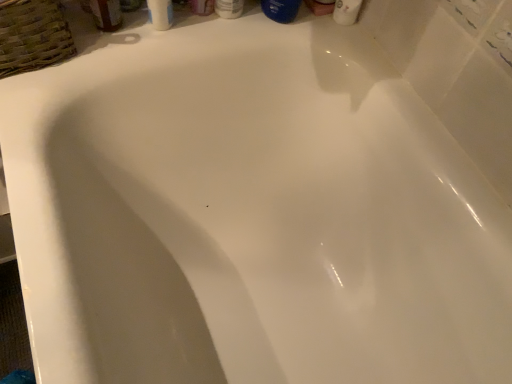
Locate an element on the screen. The width and height of the screenshot is (512, 384). white glossy bottle at upper center, the second toiletry from the left is located at coordinates (229, 8).

The image size is (512, 384). Identify the location of woven brown basket at upper left. (33, 36).

In order to face blue glossy bottle at upper center, placed as the first mouthwash when sorted from right to left, should I rotate leftwards or rightwards?

Rotate right and turn 3.417 degrees.

Find the location of `blue glossy bottle at upper center, the second mouthwash in the left-to-right sequence`. blue glossy bottle at upper center, the second mouthwash in the left-to-right sequence is located at coordinates (281, 10).

This screenshot has height=384, width=512. Identify the location of white glossy bottle at upper center, the second toiletry from the left. pyautogui.click(x=229, y=8).

Which is closer, (18,33) or (222,10)?

Point (18,33).

Considering the sizes of woven brown basket at upper left and white glossy bottle at upper center, the 1th toiletry in the right-to-left sequence, in the image, is woven brown basket at upper left taller or shorter than white glossy bottle at upper center, the 1th toiletry in the right-to-left sequence,?

woven brown basket at upper left is shorter than white glossy bottle at upper center, the 1th toiletry in the right-to-left sequence.

From the image's perspective, does woven brown basket at upper left appear higher than white glossy bottle at upper center, the 1th toiletry in the right-to-left sequence?

Incorrect, from the image's perspective, woven brown basket at upper left is lower than white glossy bottle at upper center, the 1th toiletry in the right-to-left sequence.

How distant is woven brown basket at upper left from white glossy bottle at upper center, the second toiletry from the left?

woven brown basket at upper left and white glossy bottle at upper center, the second toiletry from the left, are 33.63 centimeters apart.

Does translucent plastic mouthwash at upper left, the 1th mouthwash viewed from the left, have a larger size compared to matte plastic bottle at upper center, the second toiletry from the right?

No.

Which object is positioned more to the right, translucent plastic mouthwash at upper left, the 1th mouthwash viewed from the left, or matte plastic bottle at upper center, the first toiletry when ordered from left to right?

matte plastic bottle at upper center, the first toiletry when ordered from left to right, is more to the right.

Is translucent plastic mouthwash at upper left, the 2th mouthwash positioned from the right, shorter than matte plastic bottle at upper center, the first toiletry when ordered from left to right?

Yes, translucent plastic mouthwash at upper left, the 2th mouthwash positioned from the right, is shorter than matte plastic bottle at upper center, the first toiletry when ordered from left to right.

Between point (101, 25) and point (70, 38), which one is positioned in front?

The point (70, 38) is closer to the camera.

You are a GUI agent. You are given a task and a screenshot of the screen. Output one action in this format:
    pyautogui.click(x=<x>, y=<y>)
    Task: Click on the 1st mouthwash to the right of the woven brown basket at upper left, starting your count from the anchor
    The image size is (512, 384).
    Given the screenshot: What is the action you would take?
    pyautogui.click(x=106, y=14)

Is translucent plastic mouthwash at upper left, the 2th mouthwash positioned from the right, at the right side of woven brown basket at upper left?

Indeed, translucent plastic mouthwash at upper left, the 2th mouthwash positioned from the right, is positioned on the right side of woven brown basket at upper left.

Does translucent plastic mouthwash at upper left, the 2th mouthwash positioned from the right, have a smaller size compared to woven brown basket at upper left?

Correct, translucent plastic mouthwash at upper left, the 2th mouthwash positioned from the right, occupies less space than woven brown basket at upper left.

Which is in front, point (193, 0) or point (37, 32)?

The point (37, 32) is closer.

Is matte plastic bottle at upper center, the second toiletry from the right, inside or outside of woven brown basket at upper left?

matte plastic bottle at upper center, the second toiletry from the right, is not enclosed by woven brown basket at upper left.

Which object is more forward, matte plastic bottle at upper center, the second toiletry from the right, or woven brown basket at upper left?

woven brown basket at upper left is in front.

Measure the distance from matte plastic bottle at upper center, the first toiletry when ordered from left to right, to blue glossy bottle at upper center, the second mouthwash in the left-to-right sequence.

12.81 centimeters.

Between matte plastic bottle at upper center, the second toiletry from the right, and blue glossy bottle at upper center, the second mouthwash in the left-to-right sequence, which one has larger size?

Bigger between the two is blue glossy bottle at upper center, the second mouthwash in the left-to-right sequence.

Is matte plastic bottle at upper center, the first toiletry when ordered from left to right, facing towards blue glossy bottle at upper center, placed as the first mouthwash when sorted from right to left?

No, matte plastic bottle at upper center, the first toiletry when ordered from left to right, does not turn towards blue glossy bottle at upper center, placed as the first mouthwash when sorted from right to left.

The width and height of the screenshot is (512, 384). What are the coordinates of `the 2nd mouthwash in front of the matte plastic bottle at upper center, the second toiletry from the right, starting your count from the anchor` in the screenshot? It's located at (281, 10).

From a real-world perspective, starting from the blue glossy bottle at upper center, the second mouthwash in the left-to-right sequence, which toiletry is the 1st one below it? Please provide its 2D coordinates.

[(229, 8)]

What's the angular difference between white glossy bottle at upper center, the 1th toiletry in the right-to-left sequence, and blue glossy bottle at upper center, the second mouthwash in the left-to-right sequence,'s facing directions?

white glossy bottle at upper center, the 1th toiletry in the right-to-left sequence, and blue glossy bottle at upper center, the second mouthwash in the left-to-right sequence, are facing 60.2 degrees away from each other.

Considering their positions, is white glossy bottle at upper center, the 1th toiletry in the right-to-left sequence, located in front of or behind blue glossy bottle at upper center, placed as the first mouthwash when sorted from right to left?

Clearly, white glossy bottle at upper center, the 1th toiletry in the right-to-left sequence, is behind blue glossy bottle at upper center, placed as the first mouthwash when sorted from right to left.

Is white glossy bottle at upper center, the second toiletry from the left, surrounding blue glossy bottle at upper center, the second mouthwash in the left-to-right sequence?

No, blue glossy bottle at upper center, the second mouthwash in the left-to-right sequence, is located outside of white glossy bottle at upper center, the second toiletry from the left.

In terms of width, does woven brown basket at upper left look wider or thinner when compared to matte plastic bottle at upper center, the second toiletry from the right?

In the image, woven brown basket at upper left appears to be wider than matte plastic bottle at upper center, the second toiletry from the right.

Choose the correct answer: Is woven brown basket at upper left inside matte plastic bottle at upper center, the second toiletry from the right, or outside it?

woven brown basket at upper left exists outside the volume of matte plastic bottle at upper center, the second toiletry from the right.

Is woven brown basket at upper left positioned far away from matte plastic bottle at upper center, the first toiletry when ordered from left to right?

woven brown basket at upper left is near matte plastic bottle at upper center, the first toiletry when ordered from left to right, not far away.

Considering the positions of points (11, 32) and (209, 10), is point (11, 32) farther from camera compared to point (209, 10)?

That is False.

Which toiletry is the 2nd one when counting from the right side of the woven brown basket at upper left? Please provide its 2D coordinates.

[(229, 8)]

Find the location of `mouthwash below the matte plastic bottle at upper center, the second toiletry from the right (from the image's perspective)`. mouthwash below the matte plastic bottle at upper center, the second toiletry from the right (from the image's perspective) is located at coordinates point(106,14).

Based on their spatial positions, is blue glossy bottle at upper center, the second mouthwash in the left-to-right sequence, or woven brown basket at upper left further from translucent plastic mouthwash at upper left, the 2th mouthwash positioned from the right?

Among the two, blue glossy bottle at upper center, the second mouthwash in the left-to-right sequence, is located further to translucent plastic mouthwash at upper left, the 2th mouthwash positioned from the right.

When comparing their distances from blue glossy bottle at upper center, the second mouthwash in the left-to-right sequence, does translucent plastic mouthwash at upper left, the 1th mouthwash viewed from the left, or matte plastic bottle at upper center, the second toiletry from the right, seem further?

translucent plastic mouthwash at upper left, the 1th mouthwash viewed from the left, is positioned further to the anchor blue glossy bottle at upper center, the second mouthwash in the left-to-right sequence.

Estimate the real-world distances between objects in this image. Which object is closer to white glossy bottle at upper center, the 1th toiletry in the right-to-left sequence, translucent plastic mouthwash at upper left, the 1th mouthwash viewed from the left, or woven brown basket at upper left?

The object closer to white glossy bottle at upper center, the 1th toiletry in the right-to-left sequence, is translucent plastic mouthwash at upper left, the 1th mouthwash viewed from the left.

Which object lies nearer to the anchor point white glossy bottle at upper center, the 1th toiletry in the right-to-left sequence, blue glossy bottle at upper center, placed as the first mouthwash when sorted from right to left, or matte plastic bottle at upper center, the second toiletry from the right?

matte plastic bottle at upper center, the second toiletry from the right, lies closer to white glossy bottle at upper center, the 1th toiletry in the right-to-left sequence, than the other object.

Which object lies further to the anchor point matte plastic bottle at upper center, the second toiletry from the right, woven brown basket at upper left or blue glossy bottle at upper center, the second mouthwash in the left-to-right sequence?

Among the two, woven brown basket at upper left is located further to matte plastic bottle at upper center, the second toiletry from the right.

Which object lies further to the anchor point blue glossy bottle at upper center, placed as the first mouthwash when sorted from right to left, white glossy bottle at upper center, the second toiletry from the left, or woven brown basket at upper left?

woven brown basket at upper left.

Based on their spatial positions, is woven brown basket at upper left or blue glossy bottle at upper center, the second mouthwash in the left-to-right sequence, closer to white glossy bottle at upper center, the 1th toiletry in the right-to-left sequence?

blue glossy bottle at upper center, the second mouthwash in the left-to-right sequence, is closer to white glossy bottle at upper center, the 1th toiletry in the right-to-left sequence.

Which object lies further to the anchor point translucent plastic mouthwash at upper left, the 1th mouthwash viewed from the left, matte plastic bottle at upper center, the second toiletry from the right, or blue glossy bottle at upper center, the second mouthwash in the left-to-right sequence?

blue glossy bottle at upper center, the second mouthwash in the left-to-right sequence, lies further to translucent plastic mouthwash at upper left, the 1th mouthwash viewed from the left, than the other object.

Find the location of a particular element. mouthwash between woven brown basket at upper left and white glossy bottle at upper center, the second toiletry from the left is located at coordinates (106, 14).

Where is `mouthwash between woven brown basket at upper left and blue glossy bottle at upper center, the second mouthwash in the left-to-right sequence, in the horizontal direction`? mouthwash between woven brown basket at upper left and blue glossy bottle at upper center, the second mouthwash in the left-to-right sequence, in the horizontal direction is located at coordinates (106, 14).

The height and width of the screenshot is (384, 512). In order to click on toiletry situated between translucent plastic mouthwash at upper left, the 2th mouthwash positioned from the right, and white glossy bottle at upper center, the second toiletry from the left, from left to right in this screenshot , I will do `click(202, 7)`.

In order to click on toiletry between woven brown basket at upper left and white glossy bottle at upper center, the 1th toiletry in the right-to-left sequence, in the horizontal direction in this screenshot , I will do `click(202, 7)`.